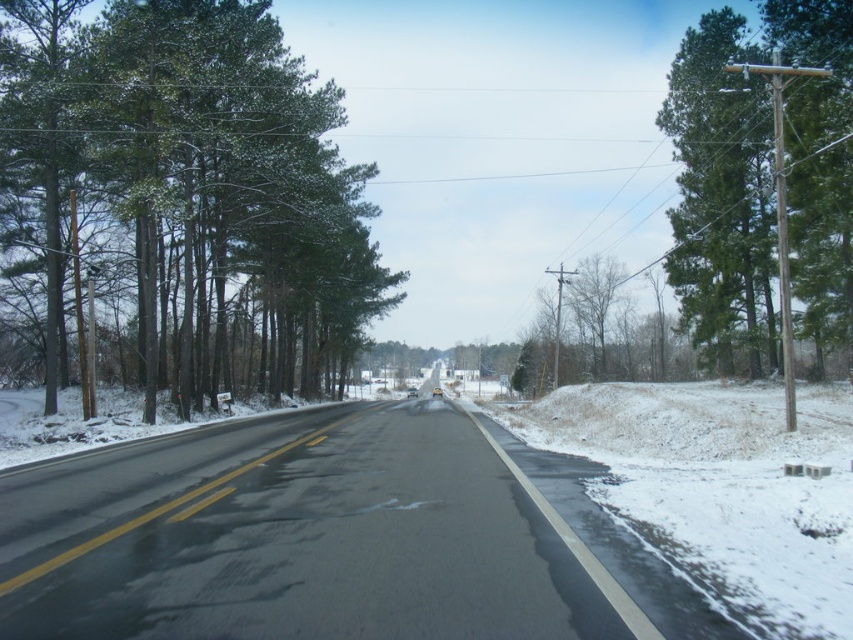
Consider the image. Does black asphalt road at center have a lesser width compared to green matte tree at right?

Correct, black asphalt road at center's width is less than green matte tree at right's.

Is black asphalt road at center below green matte tree at right?

Correct, black asphalt road at center is located below green matte tree at right.

Image resolution: width=853 pixels, height=640 pixels. I want to click on black asphalt road at center, so click(299, 536).

The image size is (853, 640). Find the location of `black asphalt road at center`. black asphalt road at center is located at coordinates (299, 536).

This screenshot has width=853, height=640. What do you see at coordinates (183, 200) in the screenshot?
I see `green matte trees at left` at bounding box center [183, 200].

Is point (9, 97) more distant than point (699, 348)?

No, it is not.

At what (x,y) coordinates should I click in order to perform the action: click on green matte trees at left. Please return your answer as a coordinate pair (x, y). The image size is (853, 640). Looking at the image, I should click on (183, 200).

Between point (62, 188) and point (314, 490), which one is positioned behind?

Positioned behind is point (62, 188).

Consider the image. Does green matte trees at left have a smaller size compared to black asphalt road at center?

Actually, green matte trees at left might be larger than black asphalt road at center.

Locate an element on the screen. green matte trees at left is located at coordinates (183, 200).

This screenshot has height=640, width=853. In order to click on green matte trees at left in this screenshot , I will do `click(183, 200)`.